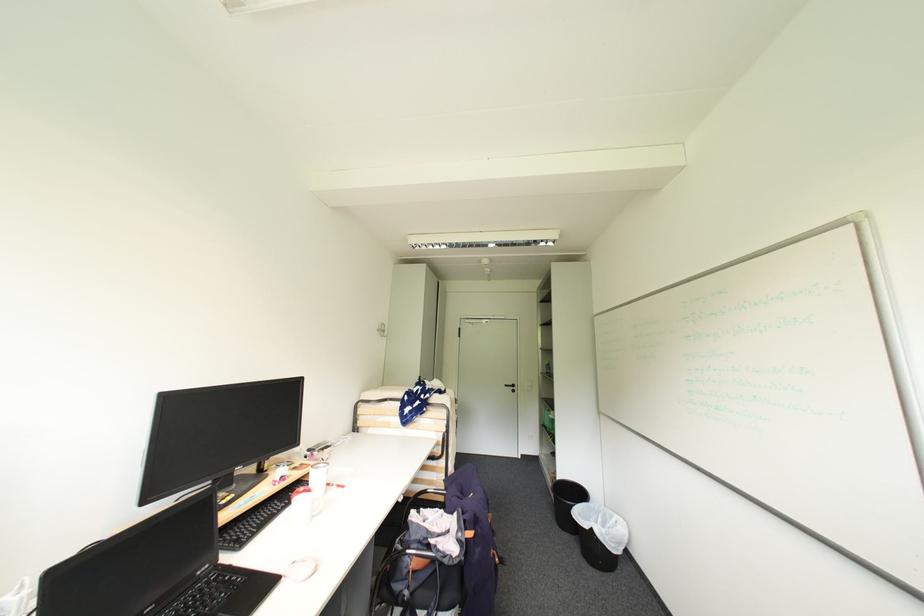
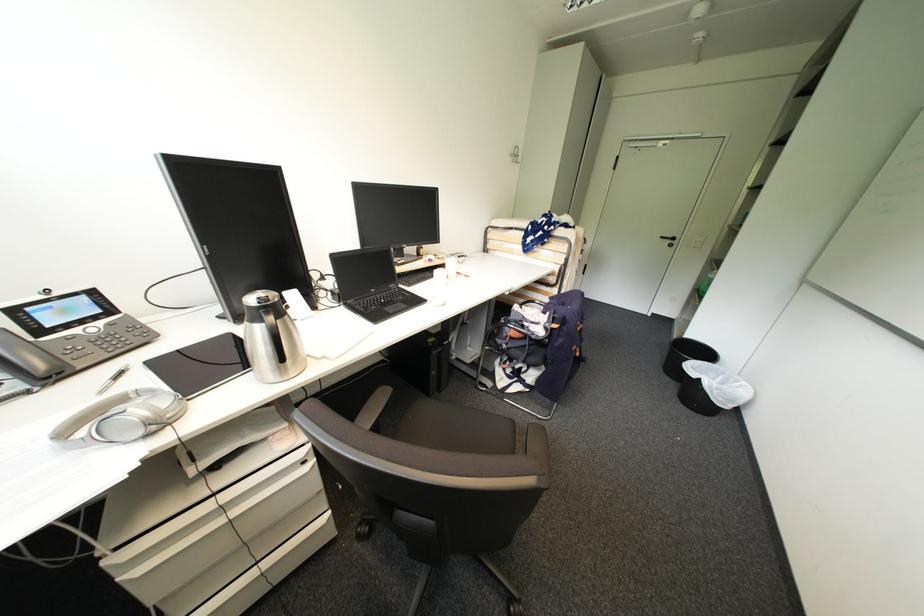
In the second image, find the point that corresponds to (435,548) in the first image.

(529, 326)